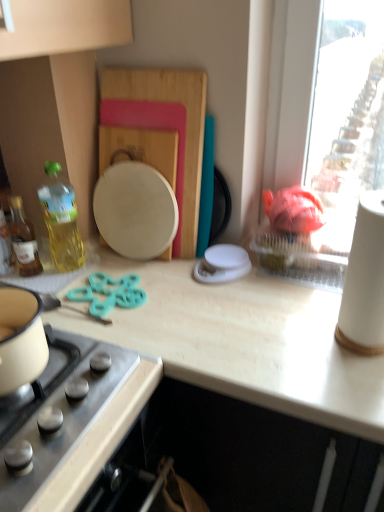
I want to click on vacant area to the right of translucent yellow bottle at left, the 1th bottle viewed from the right, so click(x=126, y=271).